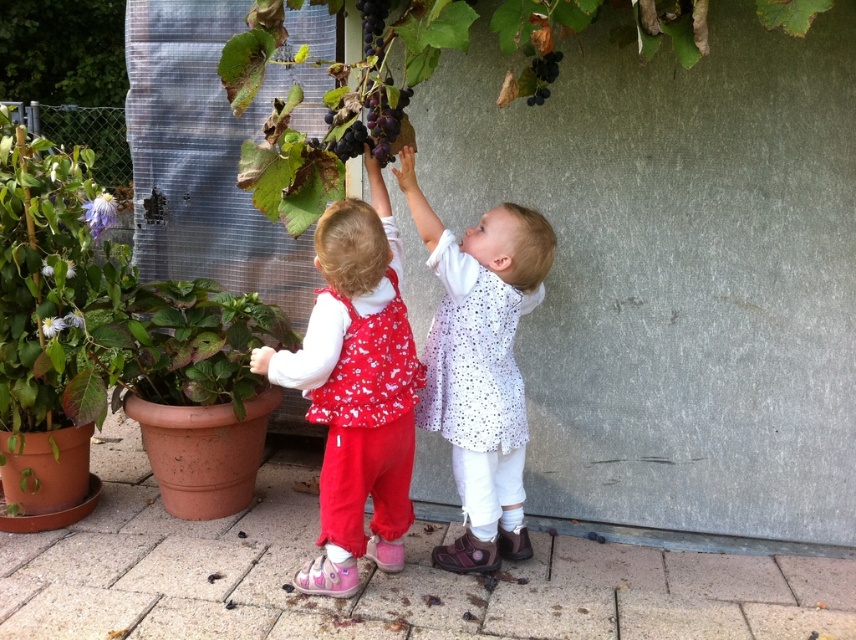
Question: Based on their relative distances, which object is farther from the black matte grapes at upper center?

Choices:
 (A) white dotted dress at center
 (B) green matte plant at lower left
 (C) green matte plant at left
 (D) dark purple grapes at center

Answer: (C)

Question: In this image, where is dark purple grapes at center located relative to black matte grapes at upper center?

Choices:
 (A) above
 (B) below

Answer: (B)

Question: Which is farther from the dark purple grapes at center?

Choices:
 (A) green matte plant at left
 (B) black matte grapes at upper center

Answer: (A)

Question: Considering the relative positions of green matte plant at left and matte red pants at center in the image provided, where is green matte plant at left located with respect to matte red pants at center?

Choices:
 (A) left
 (B) right

Answer: (A)

Question: Estimate the real-world distances between objects in this image. Which object is farther from the white dotted dress at center?

Choices:
 (A) green matte plant at left
 (B) ripe purple grapes at upper center
 (C) green matte plant at lower left

Answer: (A)

Question: Does green matte plant at left lie in front of ripe purple grapes at upper center?

Choices:
 (A) yes
 (B) no

Answer: (B)